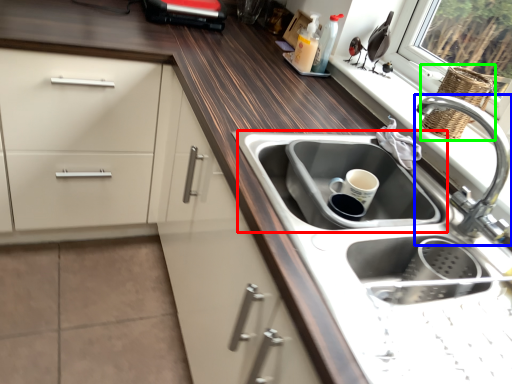
Question: Which object is the closest to the sink (highlighted by a red box)? Choose among these: tap (highlighted by a blue box) or basket (highlighted by a green box).

Choices:
 (A) tap
 (B) basket

Answer: (A)